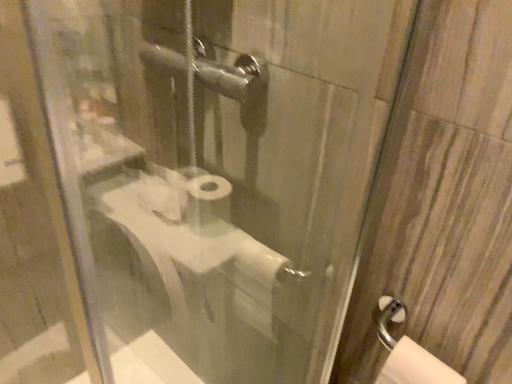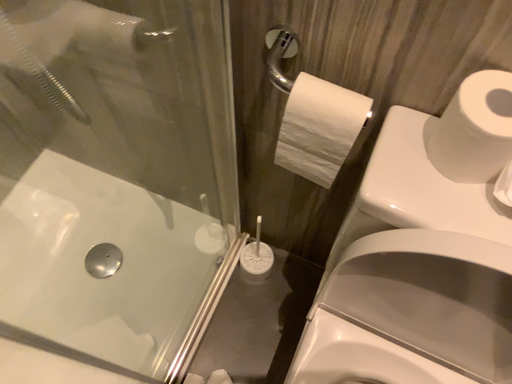
Question: How did the camera likely rotate when shooting the video?

Choices:
 (A) rotated right
 (B) rotated left

Answer: (A)